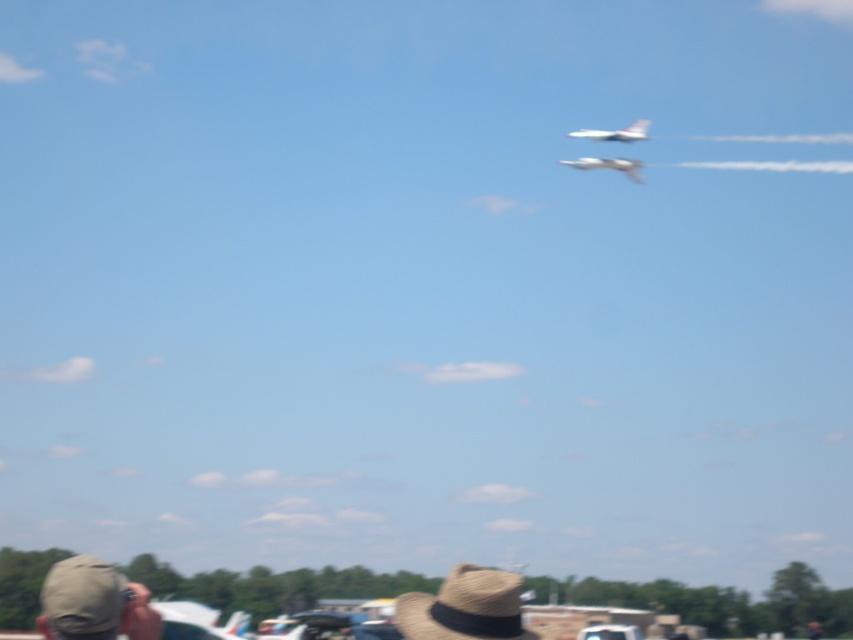
You are a photographer at the airshow and want to take a photo that includes both the khaki fabric cap at lower left and the straw textured cowboy hat at center. Which direction should you move your camera to include both in the frame?

The khaki fabric cap at lower left is to the left of the straw textured cowboy hat at center. To include both in the frame, move your camera to the right to capture the khaki fabric cap at lower left and then pan towards the center to include the straw textured cowboy hat at center.

You are standing at the bottom left corner of the image. Looking towards the center, you see a point marked at coordinates point (465, 608). What object is located at that point?

The point (465, 608) corresponds to the straw textured cowboy hat at center.

You are at the airshow and want to take a photo of the two points mentioned. Which point, point (70,593) or point (596,163), will appear larger in your camera view?

Point (70,593) will appear larger in the camera view because it is closer to the camera than point (596,163).